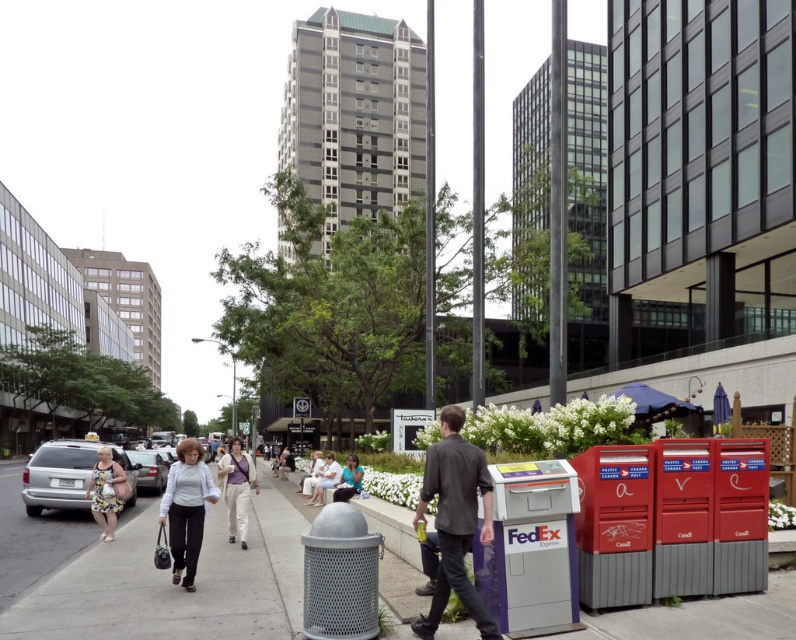
Does light gray fabric pants at lower left appear under floral dress at lower left?

Indeed, light gray fabric pants at lower left is positioned under floral dress at lower left.

Based on the photo, which is more to the right, light gray fabric pants at lower left or floral dress at lower left?

From the viewer's perspective, light gray fabric pants at lower left appears more on the right side.

Image resolution: width=796 pixels, height=640 pixels. Find the location of `light gray fabric pants at lower left`. light gray fabric pants at lower left is located at coordinates (186, 508).

The image size is (796, 640). What do you see at coordinates (237, 488) in the screenshot?
I see `light beige pants at center` at bounding box center [237, 488].

At what (x,y) coordinates should I click in order to perform the action: click on light beige pants at center. Please return your answer as a coordinate pair (x, y). Looking at the image, I should click on (237, 488).

Between point (231, 465) and point (121, 484), which one is positioned behind?

Positioned behind is point (121, 484).

Where is `light beige pants at center`? light beige pants at center is located at coordinates (237, 488).

Does point (98, 509) come in front of point (336, 481)?

Yes, point (98, 509) is in front of point (336, 481).

Which is in front, point (104, 484) or point (320, 472)?

Positioned in front is point (104, 484).

Does point (111, 502) lie behind point (318, 477)?

No.

The height and width of the screenshot is (640, 796). In order to click on floral dress at lower left in this screenshot , I will do `click(106, 492)`.